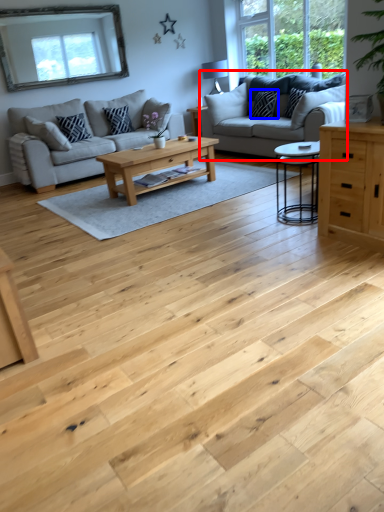
Question: Among these objects, which one is farthest to the camera, studio couch (highlighted by a red box) or pillow (highlighted by a blue box)?

Choices:
 (A) studio couch
 (B) pillow

Answer: (B)